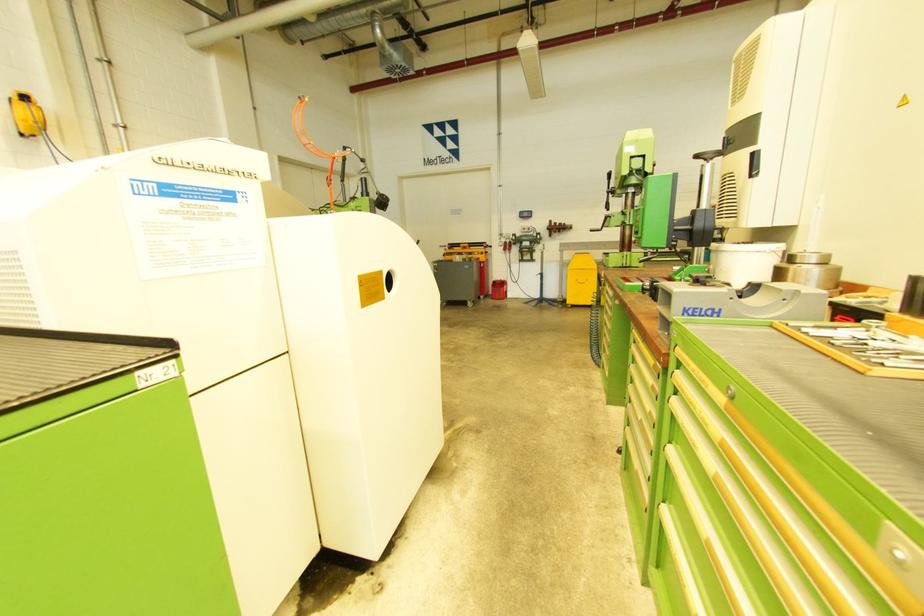
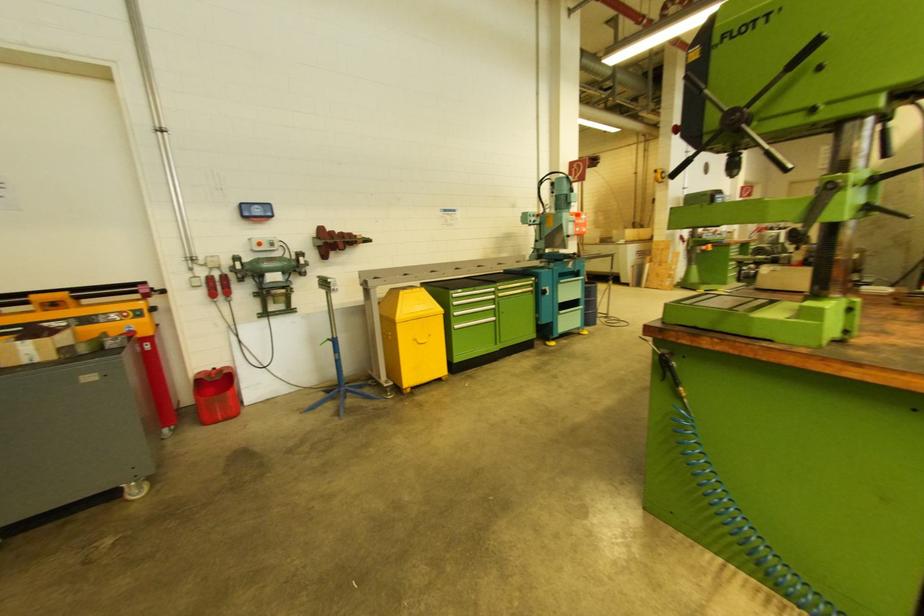
Find the pixel in the second image that matches pixel 526 231 in the first image.

(261, 246)